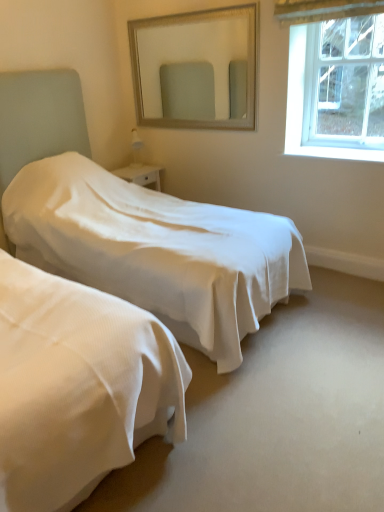
This screenshot has width=384, height=512. What do you see at coordinates (151, 242) in the screenshot?
I see `white smooth bed at center` at bounding box center [151, 242].

Describe the element at coordinates (193, 67) in the screenshot. I see `silver textured mirror at upper center` at that location.

This screenshot has height=512, width=384. Identify the location of white smooth bed at center. click(x=151, y=242).

Which of these two, white smooth bed at center or clear glass window at upper right, is bigger?

Bigger between the two is white smooth bed at center.

Considering the sizes of white smooth bed at center and clear glass window at upper right in the image, is white smooth bed at center taller or shorter than clear glass window at upper right?

white smooth bed at center is taller than clear glass window at upper right.

Between white smooth bed at center and clear glass window at upper right, which one appears on the left side from the viewer's perspective?

Positioned to the left is white smooth bed at center.

How many degrees apart are the facing directions of white smooth bed at center and clear glass window at upper right?

The angle between the facing direction of white smooth bed at center and the facing direction of clear glass window at upper right is 90.1 degrees.

Which object is further away from the camera, silver textured mirror at upper center or clear glass window at upper right?

silver textured mirror at upper center is behind.

Between silver textured mirror at upper center and clear glass window at upper right, which one has smaller width?

clear glass window at upper right.

From the image's perspective, which object appears higher, silver textured mirror at upper center or clear glass window at upper right?

silver textured mirror at upper center appears higher in the image.

Do you think silver textured mirror at upper center is within clear glass window at upper right, or outside of it?

silver textured mirror at upper center lies outside clear glass window at upper right.

Which object is more forward, clear glass window at upper right or silver textured mirror at upper center?

clear glass window at upper right is closer to the camera.

Considering the sizes of objects clear glass window at upper right and silver textured mirror at upper center in the image provided, who is thinner, clear glass window at upper right or silver textured mirror at upper center?

clear glass window at upper right.

How distant is clear glass window at upper right from silver textured mirror at upper center?

clear glass window at upper right and silver textured mirror at upper center are 3.87 feet apart from each other.

Is white smooth bed at center inside silver textured mirror at upper center?

Definitely not — white smooth bed at center is not inside silver textured mirror at upper center.

From their relative heights in the image, would you say silver textured mirror at upper center is taller or shorter than white smooth bed at center?

Considering their sizes, silver textured mirror at upper center has less height than white smooth bed at center.

Who is smaller, silver textured mirror at upper center or white smooth bed at center?

Smaller between the two is silver textured mirror at upper center.

Is white smooth bed at center surrounded by clear glass window at upper right?

No, white smooth bed at center is not surrounded by clear glass window at upper right.

Is clear glass window at upper right to the left or to the right of white smooth bed at center in the image?

In the image, clear glass window at upper right appears on the right side of white smooth bed at center.

Considering the relative positions of clear glass window at upper right and white smooth bed at center in the image provided, is clear glass window at upper right in front of white smooth bed at center?

No.

From a real-world perspective, is white smooth bed at center physically above silver textured mirror at upper center?

No.

Looking at their sizes, would you say white smooth bed at center is wider or thinner than silver textured mirror at upper center?

Considering their sizes, white smooth bed at center looks broader than silver textured mirror at upper center.

Relative to silver textured mirror at upper center, is white smooth bed at center in front or behind?

Clearly, white smooth bed at center is in front of silver textured mirror at upper center.

Considering the points (178, 272) and (178, 23), which point is behind, point (178, 272) or point (178, 23)?

The point (178, 23) is more distant.

Where is `window above the white smooth bed at center (from a real-world perspective)`? The image size is (384, 512). window above the white smooth bed at center (from a real-world perspective) is located at coordinates (337, 83).

Locate an element on the screen. This screenshot has height=512, width=384. window that is on the right side of silver textured mirror at upper center is located at coordinates (337, 83).

Estimate the real-world distances between objects in this image. Which object is further from white smooth bed at center, silver textured mirror at upper center or clear glass window at upper right?

silver textured mirror at upper center.

When comparing their distances from silver textured mirror at upper center, does white smooth bed at center or clear glass window at upper right seem closer?

clear glass window at upper right is closer to silver textured mirror at upper center.

When comparing their distances from white smooth bed at center, does clear glass window at upper right or silver textured mirror at upper center seem closer?

clear glass window at upper right is positioned closer to the anchor white smooth bed at center.

Looking at this image, when comparing their distances from clear glass window at upper right, does white smooth bed at center or silver textured mirror at upper center seem closer?

The object closer to clear glass window at upper right is silver textured mirror at upper center.

Looking at the image, which one is located closer to clear glass window at upper right, silver textured mirror at upper center or white smooth bed at center?

Among the two, silver textured mirror at upper center is located nearer to clear glass window at upper right.

Considering their positions, is clear glass window at upper right positioned closer to silver textured mirror at upper center than white smooth bed at center?

clear glass window at upper right is positioned closer to the anchor silver textured mirror at upper center.

At what (x,y) coordinates should I click in order to perform the action: click on mirror between white smooth bed at center and clear glass window at upper right from left to right. Please return your answer as a coordinate pair (x, y). Image resolution: width=384 pixels, height=512 pixels. Looking at the image, I should click on (193, 67).